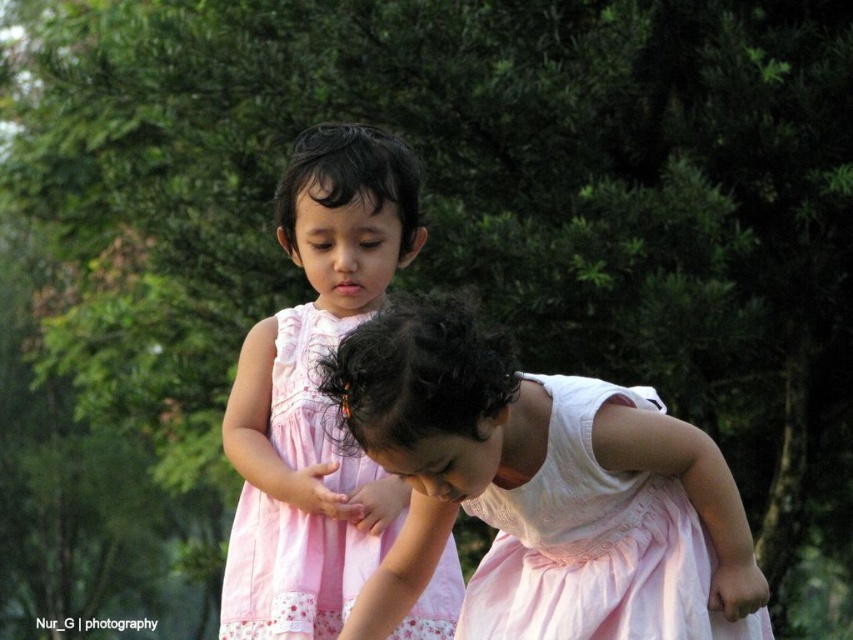
Question: Which of the following is the closest to the observer?

Choices:
 (A) (260, 500)
 (B) (633, 476)

Answer: (B)

Question: Is pink satin dress at center in front of pink cotton dress at center?

Choices:
 (A) no
 (B) yes

Answer: (B)

Question: Does pink satin dress at center have a lesser width compared to pink cotton dress at center?

Choices:
 (A) no
 (B) yes

Answer: (A)

Question: Is pink satin dress at center wider than pink cotton dress at center?

Choices:
 (A) no
 (B) yes

Answer: (B)